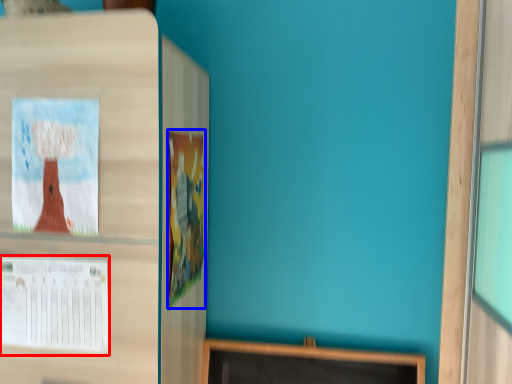
Question: Which object is further to the camera taking this photo, poster (highlighted by a red box) or poster (highlighted by a blue box)?

Choices:
 (A) poster
 (B) poster

Answer: (B)